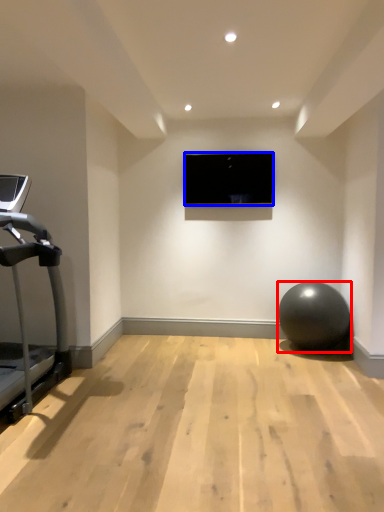
Question: Which point is further to the camera, ball (highlighted by a red box) or computer screen (highlighted by a blue box)?

Choices:
 (A) ball
 (B) computer screen

Answer: (B)